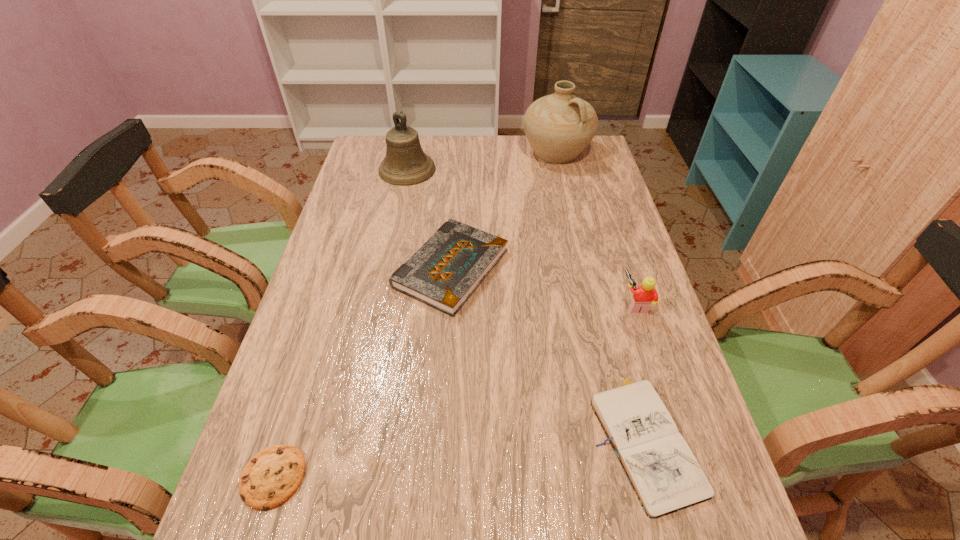
Where is `empty location between the third tallest object and the shortest object`? Image resolution: width=960 pixels, height=540 pixels. empty location between the third tallest object and the shortest object is located at coordinates (454, 390).

I want to click on blank region between the pottery and the cookie, so click(x=415, y=315).

Where is `free spot between the bell and the pottery`? free spot between the bell and the pottery is located at coordinates (482, 161).

Image resolution: width=960 pixels, height=540 pixels. What are the coordinates of `blank region between the bell and the fourth shortest object` in the screenshot? It's located at (521, 237).

Find the location of a particular element. vacant point located between the shorter notebook and the Lego is located at coordinates (639, 370).

Locate an element on the screen. This screenshot has height=540, width=960. free spot between the fifth tallest object and the Lego is located at coordinates (639, 370).

Where is `vacant space that is in between the pottery and the second tallest object`? The height and width of the screenshot is (540, 960). vacant space that is in between the pottery and the second tallest object is located at coordinates (482, 161).

This screenshot has height=540, width=960. In order to click on vacant space that is in between the pottery and the nearer notebook in this screenshot , I will do `click(600, 295)`.

Identify which object is located as the third nearest to the fourth tallest object. Please provide its 2D coordinates. Your answer should be formatted as a tuple, i.e. [(x, y)], where the tuple contains the x and y coordinates of a point satisfying the conditions above.

[(645, 294)]

Locate which object is the fourth closest to the pottery. Please provide its 2D coordinates. Your answer should be formatted as a tuple, i.e. [(x, y)], where the tuple contains the x and y coordinates of a point satisfying the conditions above.

[(664, 473)]